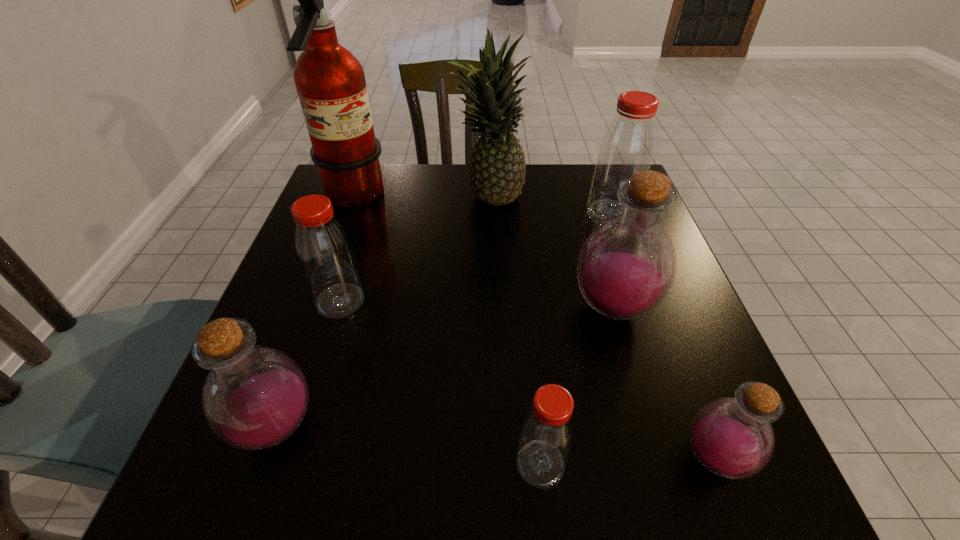
I want to click on empty space between the biggest red bottle and the smallest purple bottle, so click(662, 336).

Image resolution: width=960 pixels, height=540 pixels. In order to click on free spot between the smallest purple bottle and the second biggest red bottle in this screenshot , I will do `click(527, 380)`.

Identify the location of free space between the biggest red bottle and the tallest object. (482, 206).

Point out which object is positioned as the nearest to the smallest purple bottle. Please provide its 2D coordinates. Your answer should be formatted as a tuple, i.e. [(x, y)], where the tuple contains the x and y coordinates of a point satisfying the conditions above.

[(626, 267)]

Select which object is the seventh closest to the biggest purple bottle. Please provide its 2D coordinates. Your answer should be formatted as a tuple, i.e. [(x, y)], where the tuple contains the x and y coordinates of a point satisfying the conditions above.

[(330, 81)]

Locate which bottle is the third closest to the biggest red bottle. Please provide its 2D coordinates. Your answer should be formatted as a tuple, i.e. [(x, y)], where the tuple contains the x and y coordinates of a point satisfying the conditions above.

[(324, 251)]

Where is `bottle that can be found as the closest to the second biggest red bottle`? This screenshot has height=540, width=960. bottle that can be found as the closest to the second biggest red bottle is located at coordinates (255, 397).

Where is `red bottle that is the closest to the biggest purple bottle`? The height and width of the screenshot is (540, 960). red bottle that is the closest to the biggest purple bottle is located at coordinates (628, 144).

Identify which red bottle is the second closest to the biggest purple bottle. Please provide its 2D coordinates. Your answer should be formatted as a tuple, i.e. [(x, y)], where the tuple contains the x and y coordinates of a point satisfying the conditions above.

[(547, 432)]

The width and height of the screenshot is (960, 540). Identify the location of the closest purple bottle to the fire extinguisher. (255, 397).